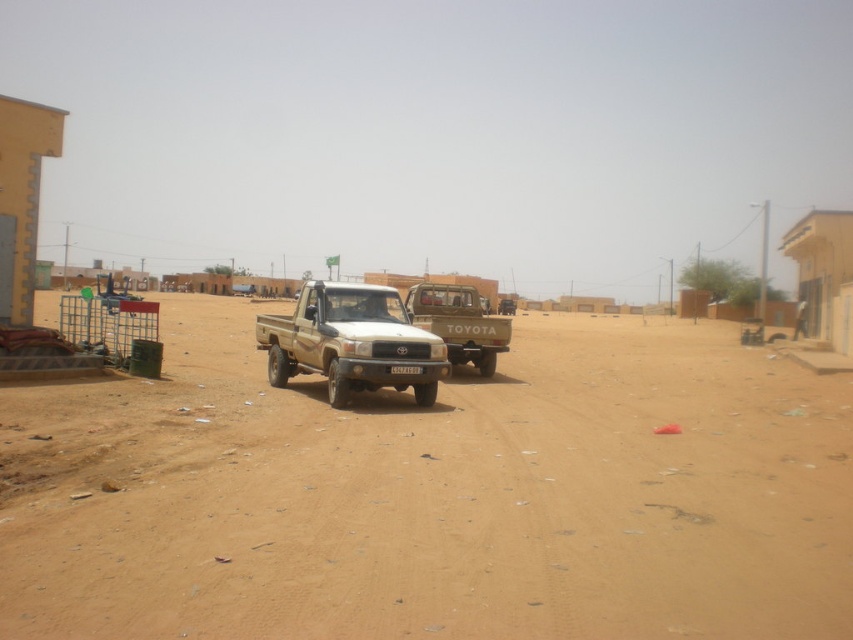
Who is more forward, (387, 378) or (418, 369)?

Point (387, 378)

Which is behind, point (283, 349) or point (403, 368)?

The point (283, 349) is more distant.

You are a GUI agent. You are given a task and a screenshot of the screen. Output one action in this format:
    pyautogui.click(x=<x>, y=<y>)
    Task: Click on the matte beige truck at center
    The height and width of the screenshot is (640, 853).
    Given the screenshot: What is the action you would take?
    pyautogui.click(x=351, y=340)

Find the location of a particular element. brown sandy dirt at center is located at coordinates (436, 496).

Is brown sandy dirt at center to the left of matte beige truck at center from the viewer's perspective?

No, brown sandy dirt at center is not to the left of matte beige truck at center.

Who is more forward, (215, 308) or (387, 349)?

Point (387, 349) is in front.

Where is `brown sandy dirt at center`? The image size is (853, 640). brown sandy dirt at center is located at coordinates (436, 496).

Can you confirm if brown sandy dirt at center is taller than matte brown truck at center?

In fact, brown sandy dirt at center may be shorter than matte brown truck at center.

Measure the distance between brown sandy dirt at center and camera.

3.47 meters

Where is `brown sandy dirt at center`? Image resolution: width=853 pixels, height=640 pixels. brown sandy dirt at center is located at coordinates (436, 496).

Locate an element on the screen. This screenshot has width=853, height=640. brown sandy dirt at center is located at coordinates (436, 496).